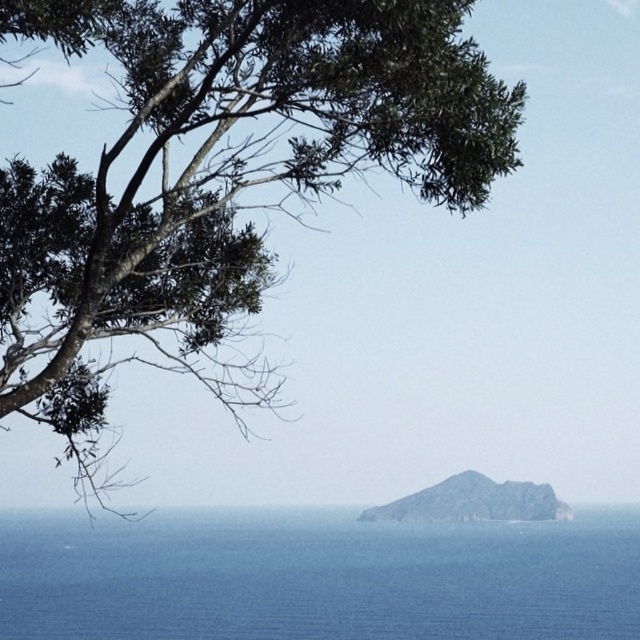
You are standing on a cliff overlooking the coast and see the green leafy tree at upper left and the blue water at center. Which object is bigger in the scene?

The green leafy tree at upper left is larger than the blue water at center.

You are a photographer trying to capture the rugged stone island at center in your shot. However, the green leafy tree at upper left is blocking part of the island. Can you move to a position where the tree is no longer blocking the island?

The green leafy tree at upper left is in front of rugged stone island at center, so moving your position might allow you to angle the shot so the tree is no longer blocking the island.

You are standing on a cliff overlooking the coast and see the green leafy tree at upper left and the blue water at center. Which object is taller from your viewpoint?

The green leafy tree at upper left is taller than the blue water at center.